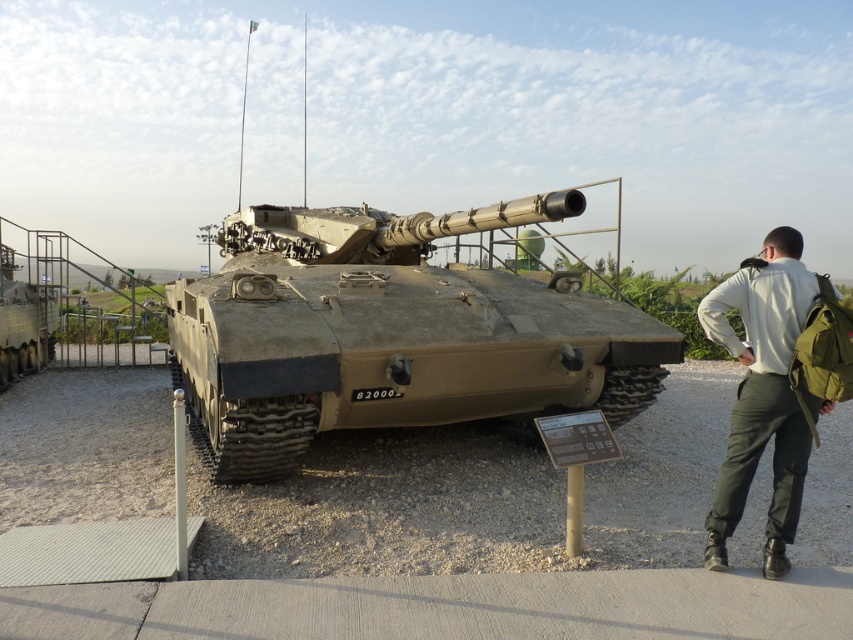
Question: Can you confirm if camouflage textured tank at center is smaller than khaki fabric pants at right?

Choices:
 (A) no
 (B) yes

Answer: (A)

Question: Which point is farther to the camera?

Choices:
 (A) camouflage textured tank at center
 (B) khaki fabric pants at right

Answer: (A)

Question: Observing the image, what is the correct spatial positioning of camouflage textured tank at center in reference to khaki fabric pants at right?

Choices:
 (A) left
 (B) right

Answer: (A)

Question: Can you confirm if camouflage textured tank at center is thinner than khaki fabric pants at right?

Choices:
 (A) yes
 (B) no

Answer: (B)

Question: Among these points, which one is farthest from the camera?

Choices:
 (A) (786, 339)
 (B) (573, 396)

Answer: (B)